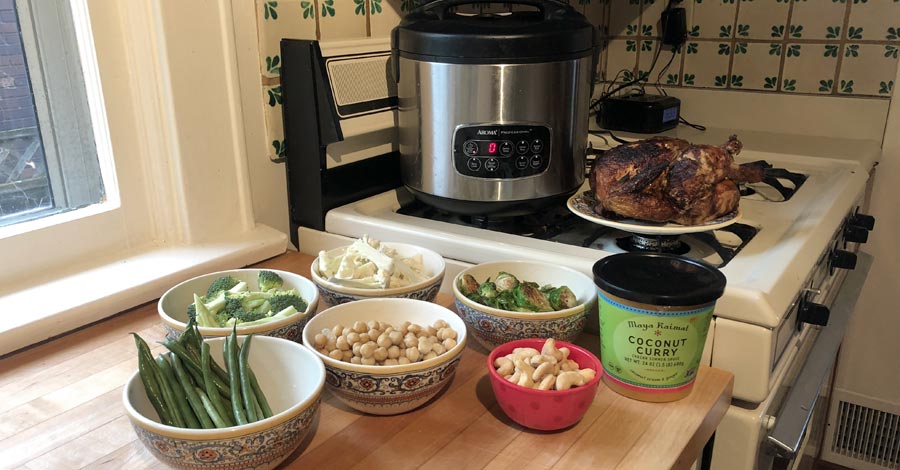
Image resolution: width=900 pixels, height=470 pixels. I want to click on window, so click(x=40, y=151).